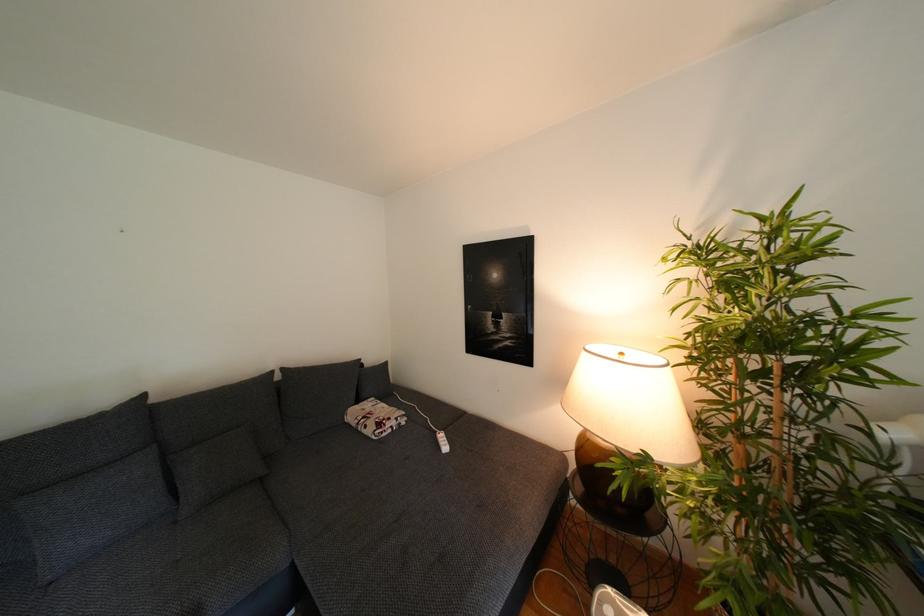
The image size is (924, 616). Identify the location of sofa sitting surface. (235, 517).